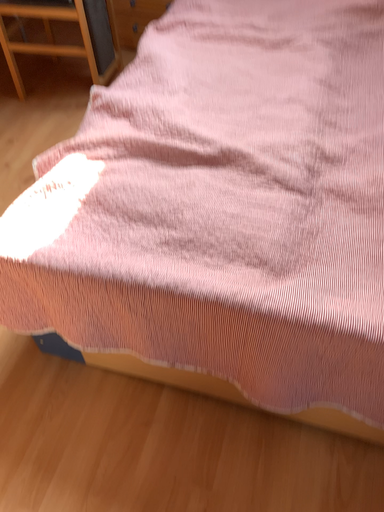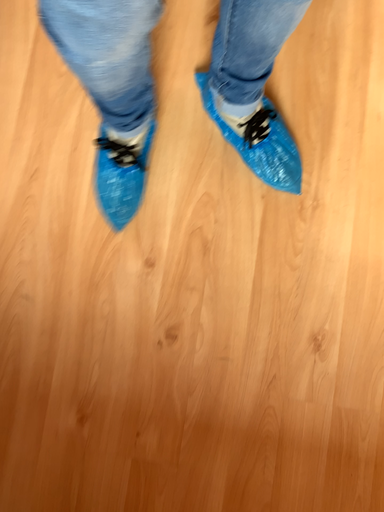
Question: Which way did the camera rotate in the video?

Choices:
 (A) rotated upward
 (B) rotated downward

Answer: (A)